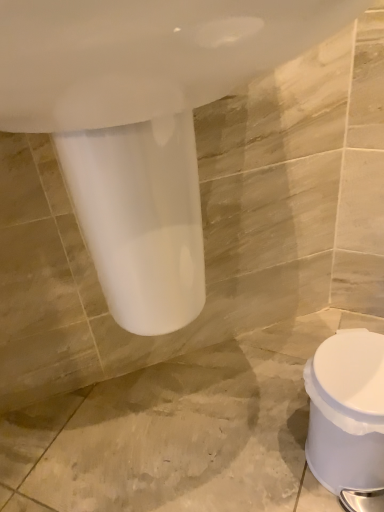
Find the location of a particular element. The width and height of the screenshot is (384, 512). free space above white plastic toilet at lower right (from a real-world perspective) is located at coordinates click(x=352, y=371).